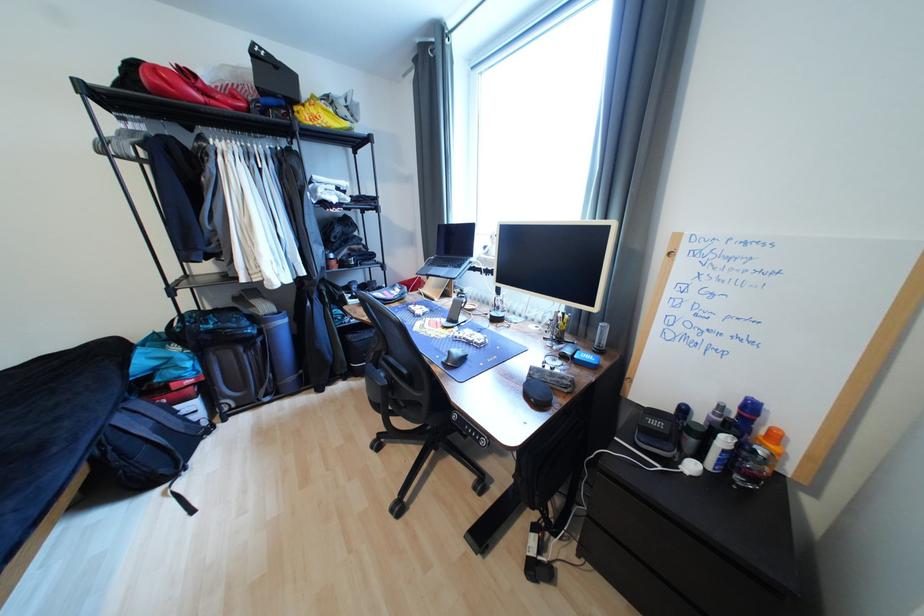
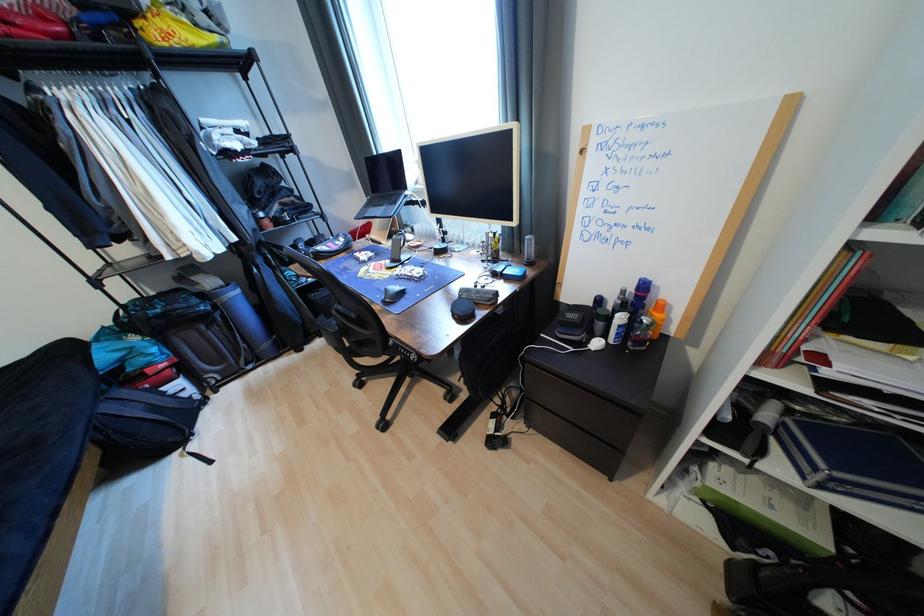
In the second image, find the point that corresponds to point 453,268 in the first image.

(388, 207)